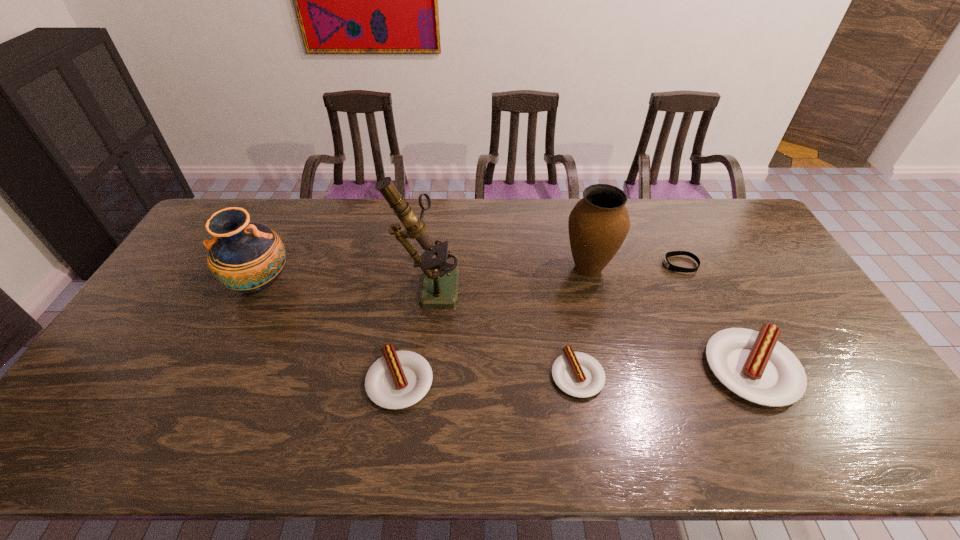
Where is `object at the near right corner`? Image resolution: width=960 pixels, height=540 pixels. object at the near right corner is located at coordinates (754, 365).

What are the coordinates of `free space at the far edge` in the screenshot? It's located at (451, 221).

The height and width of the screenshot is (540, 960). Identify the location of free location at the near edge of the desktop. tap(577, 409).

Find the location of a particular element. Image resolution: width=960 pixels, height=540 pixels. free spot at the left edge of the desktop is located at coordinates (157, 344).

Locate an element on the screen. Image resolution: width=960 pixels, height=540 pixels. free space at the right edge of the desktop is located at coordinates (757, 284).

Locate an element on the screen. This screenshot has height=540, width=960. vacant area between the second tallest sausage and the tallest object is located at coordinates (414, 333).

Find the location of `unoccupied position between the second sausage from left to right and the shortest object`. unoccupied position between the second sausage from left to right and the shortest object is located at coordinates (629, 320).

Locate an element on the screen. free area in between the fourth tallest object and the shortest sausage is located at coordinates (664, 372).

This screenshot has width=960, height=540. I want to click on vacant space that's between the second shortest sausage and the urn, so click(x=494, y=324).

I want to click on free space that is in between the leftmost object and the wristband, so click(x=470, y=274).